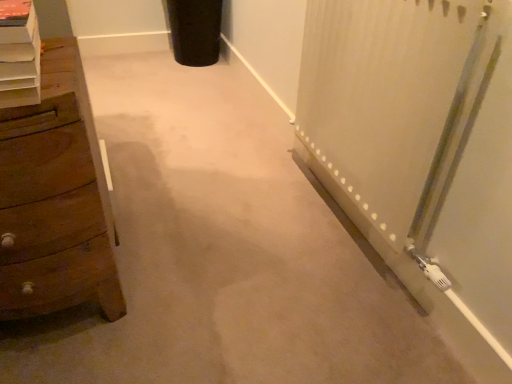
Question: Based on their positions, is wooden chest of drawers at left located to the left or right of white wooden shelf at left?

Choices:
 (A) right
 (B) left

Answer: (B)

Question: From the image's perspective, is wooden chest of drawers at left positioned above or below white wooden shelf at left?

Choices:
 (A) above
 (B) below

Answer: (B)

Question: In terms of size, does wooden chest of drawers at left appear bigger or smaller than white wooden shelf at left?

Choices:
 (A) small
 (B) big

Answer: (B)

Question: From the image's perspective, is white wooden shelf at left positioned above or below wooden chest of drawers at left?

Choices:
 (A) above
 (B) below

Answer: (A)

Question: Is white wooden shelf at left inside the boundaries of wooden chest of drawers at left, or outside?

Choices:
 (A) inside
 (B) outside

Answer: (B)

Question: Is white wooden shelf at left wider or thinner than wooden chest of drawers at left?

Choices:
 (A) wide
 (B) thin

Answer: (B)

Question: Based on their sizes in the image, would you say white wooden shelf at left is bigger or smaller than wooden chest of drawers at left?

Choices:
 (A) small
 (B) big

Answer: (A)